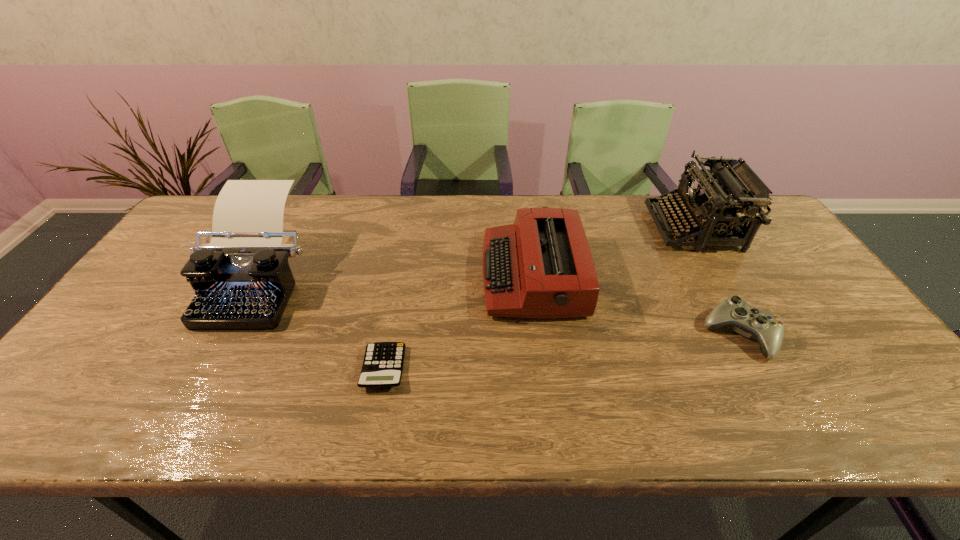
In the image, there is a desktop. Where is `vacant region at the far edge`? This screenshot has height=540, width=960. vacant region at the far edge is located at coordinates (415, 220).

Locate an element on the screen. The height and width of the screenshot is (540, 960). blank area at the near edge is located at coordinates (726, 418).

Identify the location of free space at the left edge of the desktop. (191, 293).

Where is `vacant space at the right edge of the desktop`? vacant space at the right edge of the desktop is located at coordinates 827,298.

Identify the location of free space between the third object from right to left and the control. (636, 305).

At what (x,y) coordinates should I click in order to perform the action: click on empty location between the second object from left to right and the leftmost object. Please return your answer as a coordinate pair (x, y). Image resolution: width=960 pixels, height=540 pixels. Looking at the image, I should click on (320, 322).

Where is `vacant region between the rightmost typewriter and the second shortest object`? Image resolution: width=960 pixels, height=540 pixels. vacant region between the rightmost typewriter and the second shortest object is located at coordinates (717, 281).

Where is `free point between the shortest typewriter and the second object from left to right`? free point between the shortest typewriter and the second object from left to right is located at coordinates (458, 322).

The image size is (960, 540). I want to click on vacant space in between the leftmost typewriter and the fourth object from right to left, so click(320, 322).

The height and width of the screenshot is (540, 960). Find the location of `vacant area that lies between the fourth object from right to left and the third object from right to left`. vacant area that lies between the fourth object from right to left and the third object from right to left is located at coordinates (458, 322).